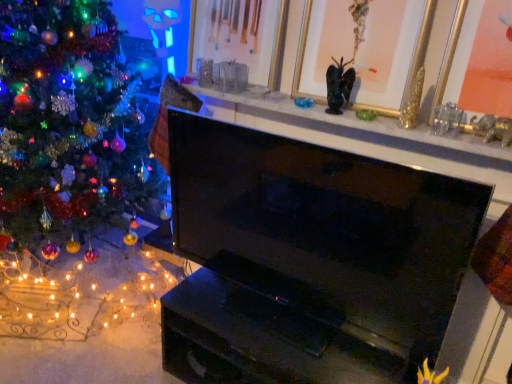
This screenshot has width=512, height=384. I want to click on vacant location below black glossy tv at center (from a real-world perspective), so click(x=288, y=313).